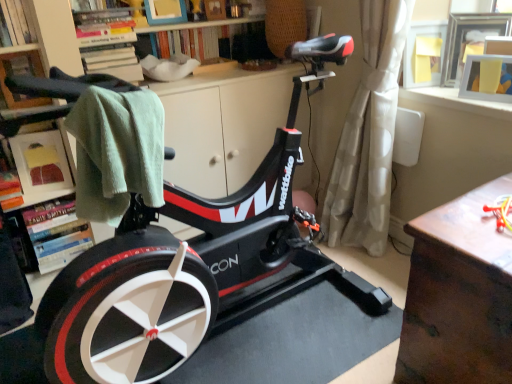
In order to click on free space to the left of wooden picture frame at upper right, placed as the second picture frame when sorted from back to front in this screenshot , I will do `click(452, 99)`.